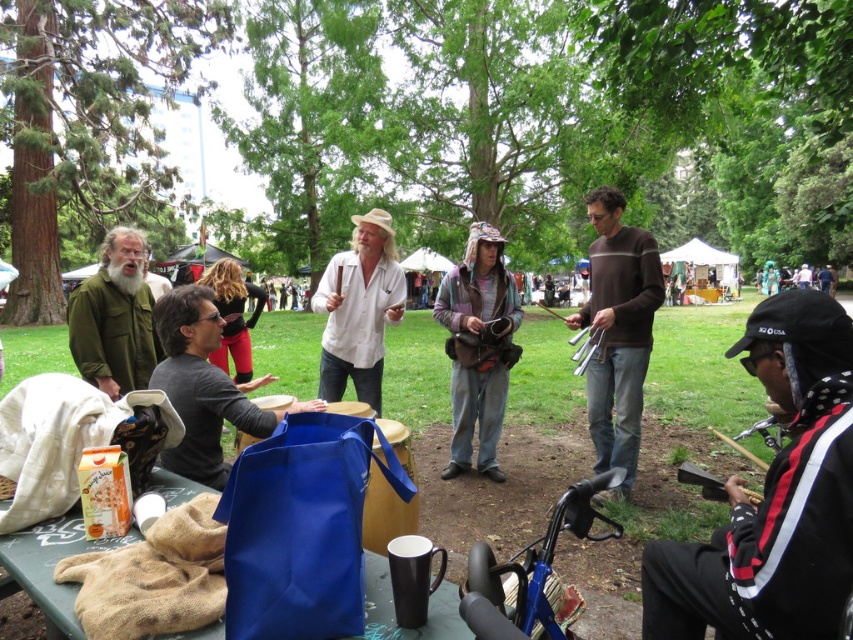
Can you confirm if brown striped sweater at center is positioned above matte black bag at center?

Yes.

Where is `brown striped sweater at center`? This screenshot has width=853, height=640. brown striped sweater at center is located at coordinates (618, 332).

You are a GUI agent. You are given a task and a screenshot of the screen. Output one action in this format:
    pyautogui.click(x=<x>, y=<y>)
    Task: Click on the brown striped sweater at center
    The image size is (853, 640).
    Given the screenshot: What is the action you would take?
    pyautogui.click(x=618, y=332)

Which is below, black and white jacket at lower right or blue fabric bag at lower center?

blue fabric bag at lower center is below.

Does black and white jacket at lower right have a smaller size compared to blue fabric bag at lower center?

Actually, black and white jacket at lower right might be larger than blue fabric bag at lower center.

The width and height of the screenshot is (853, 640). I want to click on black and white jacket at lower right, so click(775, 497).

The image size is (853, 640). What are the coordinates of `black and white jacket at lower right` in the screenshot? It's located at (775, 497).

Who is positioned more to the left, matte black bag at center or white cotton shirt at center?

From the viewer's perspective, matte black bag at center appears more on the left side.

Which of these two, matte black bag at center or white cotton shirt at center, stands taller?

Standing taller between the two is white cotton shirt at center.

Locate an element on the screen. matte black bag at center is located at coordinates (204, 387).